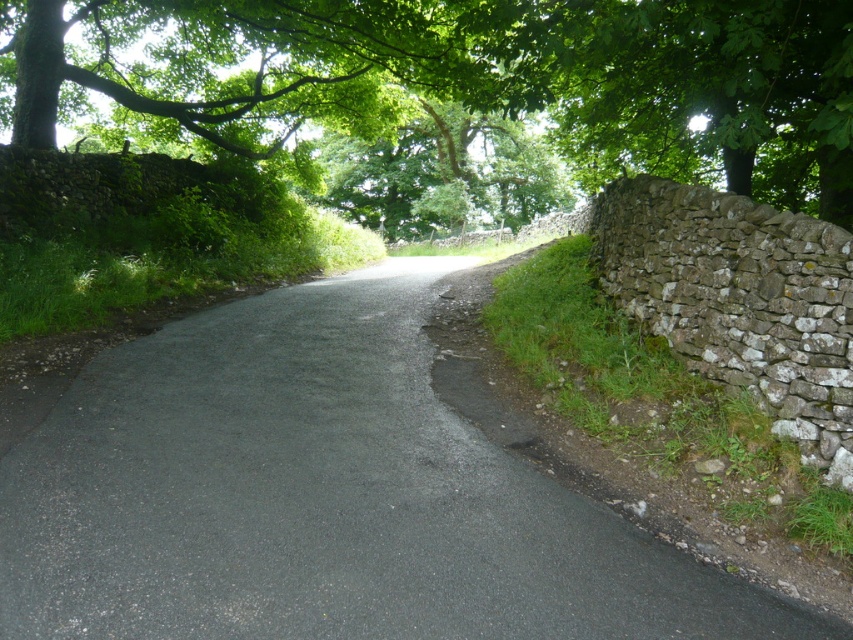
Question: Is asphalt road at center behind green leafy tree at upper left?

Choices:
 (A) no
 (B) yes

Answer: (A)

Question: Can you confirm if asphalt road at center is bigger than green leafy tree at upper left?

Choices:
 (A) yes
 (B) no

Answer: (B)

Question: Which point is closer to the camera?

Choices:
 (A) (141, 108)
 (B) (155, 536)

Answer: (B)

Question: Is asphalt road at center further to camera compared to green leafy tree at upper left?

Choices:
 (A) no
 (B) yes

Answer: (A)

Question: Which point is farther from the camera taking this photo?

Choices:
 (A) (286, 294)
 (B) (775, 20)

Answer: (A)